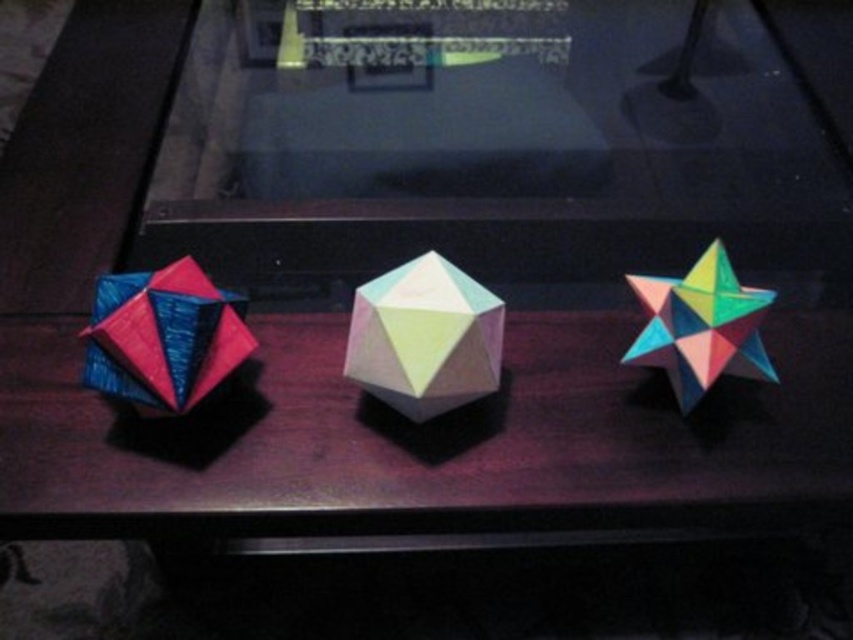
You are a curator arranging these models for an exhibition. The museum requires that all displayed items must be at least 10 inches apart for safety. Are the pastel paper polyhedron at center and the multicolored paper star at right compliant with this requirement?

The distance between the pastel paper polyhedron at center and the multicolored paper star at right is 8.64 inches, which is less than the required 10 inches. Therefore, they are not compliant with the museum safety requirement.

You are standing at the camera position looking at the three geometric paper models on the dark wooden surface. Which of the models is closest to the point labeled as point (x=360, y=291)?

The point labeled as point (x=360, y=291) is 34.72 inches away from the camera, so the model closest to this point would be the one positioned nearest to this coordinate. However, without specific distances between the models and the point, I cannot determine which model is closest.

You are an art curator arranging these models for an exhibition. You need to ensure that the pastel paper polyhedron at center and the shiny blue and pink paper cube at left are spaced appropriately. Given their sizes, which model requires more horizontal space between them and other exhibits to avoid overcrowding?

The pastel paper polyhedron at center requires more horizontal space because its width surpasses that of the shiny blue and pink paper cube at left, as stated in the description.